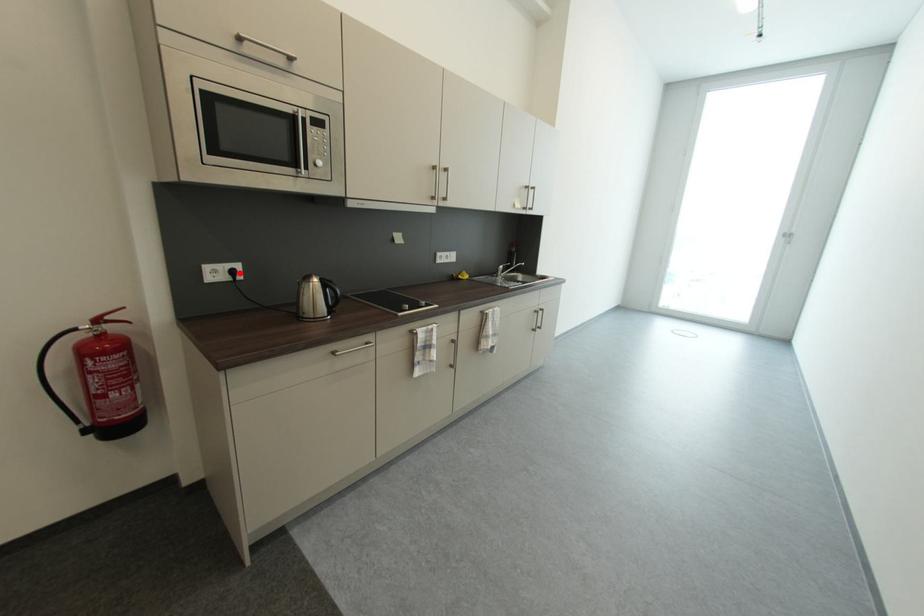
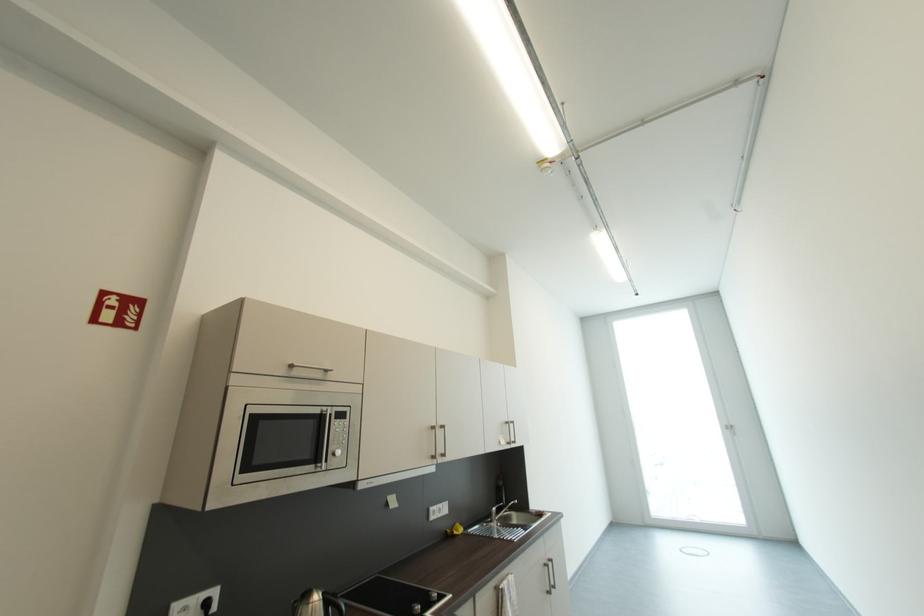
Find the pixel in the second image that matches the highlighted location in the first image.

(213, 605)